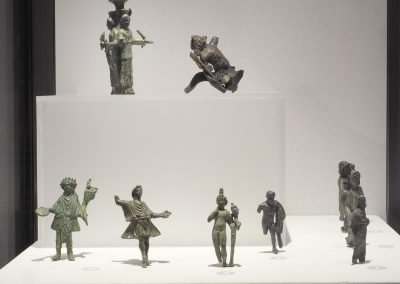
Identify the location of figurine on the far left. (63, 208).